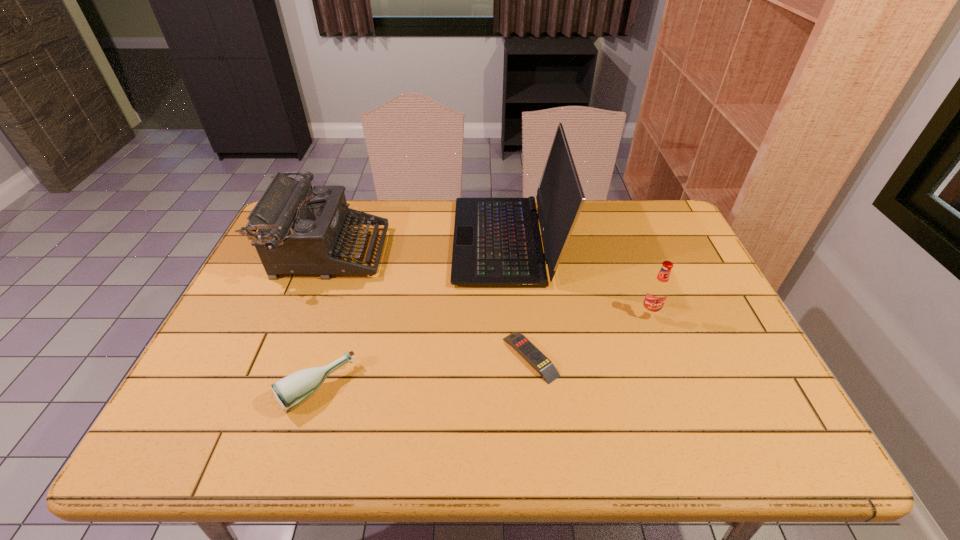
At what (x,y) coordinates should I click in order to perform the action: click on the tallest object. Please return your answer as a coordinate pair (x, y). The width and height of the screenshot is (960, 540). Looking at the image, I should click on (497, 243).

At what (x,y) coordinates should I click in order to perform the action: click on typewriter. Please return your answer as a coordinate pair (x, y). The height and width of the screenshot is (540, 960). Looking at the image, I should click on (301, 229).

Locate an element on the screen. the rightmost object is located at coordinates (657, 292).

Find the location of `root beer`. root beer is located at coordinates (657, 292).

Locate an element on the screen. The image size is (960, 540). the fourth tallest object is located at coordinates (291, 391).

The image size is (960, 540). Identify the location of remote control. (547, 370).

You are a GUI agent. You are given a task and a screenshot of the screen. Output one action in this format:
    pyautogui.click(x=<x>, y=<y>)
    Task: Click on the vacant space located on the screen of the tallest object
    The width and height of the screenshot is (960, 540).
    Given the screenshot: What is the action you would take?
    pyautogui.click(x=404, y=241)

The height and width of the screenshot is (540, 960). I want to click on vacant space located on the screen of the tallest object, so click(x=392, y=241).

At what (x,y) coordinates should I click in order to perform the action: click on vacant region located 0.060m on the screen of the tallest object. Please return your answer as a coordinate pair (x, y). Looking at the image, I should click on (435, 241).

Locate an element on the screen. Image resolution: width=960 pixels, height=540 pixels. free region located on the typing side of the fourth shortest object is located at coordinates (496, 252).